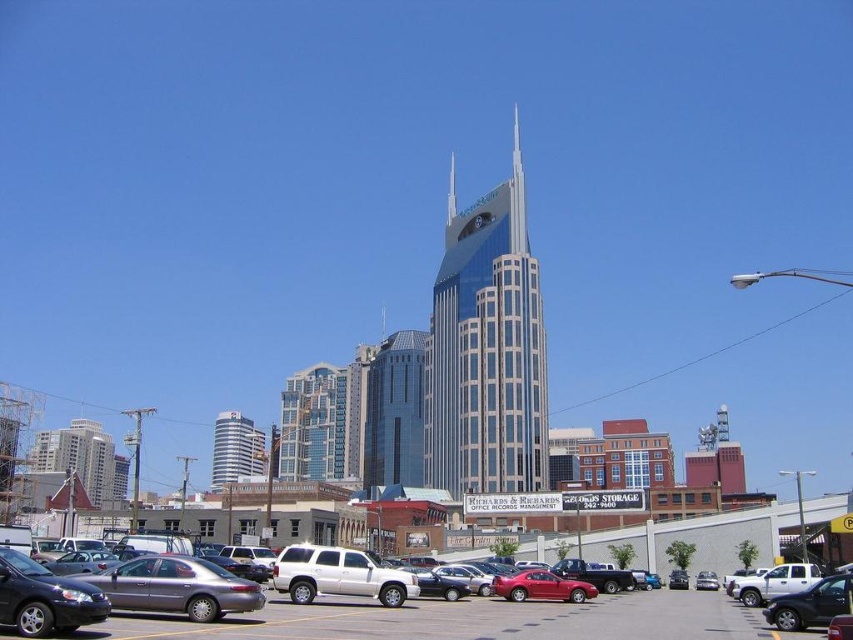
Question: Which point appears farthest from the camera in this image?

Choices:
 (A) pyautogui.click(x=697, y=582)
 (B) pyautogui.click(x=421, y=369)
 (C) pyautogui.click(x=91, y=582)
 (D) pyautogui.click(x=231, y=426)

Answer: (D)

Question: Which object is farther from the camera taking this photo?

Choices:
 (A) white glossy building at center
 (B) gray asphalt parking lot at lower center
 (C) metallic gray sedan at lower left
 (D) metallic silver sedan at center

Answer: (A)

Question: Which point is closer to the camera taking this photo?

Choices:
 (A) (402, 380)
 (B) (523, 301)

Answer: (B)

Question: Is gray asphalt parking lot at lower center positioned before glassy steel skyscraper at center?

Choices:
 (A) no
 (B) yes

Answer: (B)

Question: In this image, where is gray asphalt parking lot at lower center located relative to white glossy building at center?

Choices:
 (A) right
 (B) left

Answer: (A)

Question: Does glass skyscraper at center have a lesser width compared to gray asphalt parking lot at lower center?

Choices:
 (A) no
 (B) yes

Answer: (B)